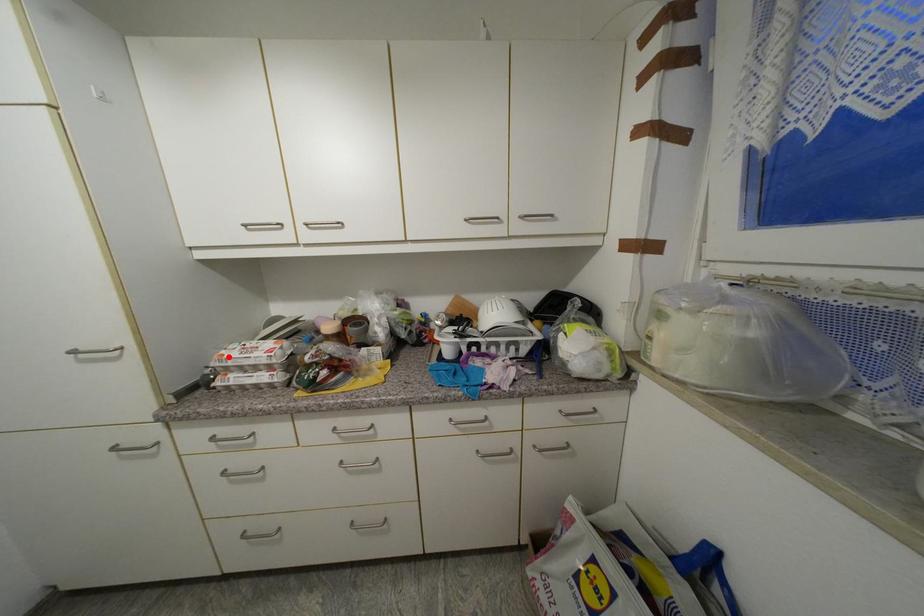
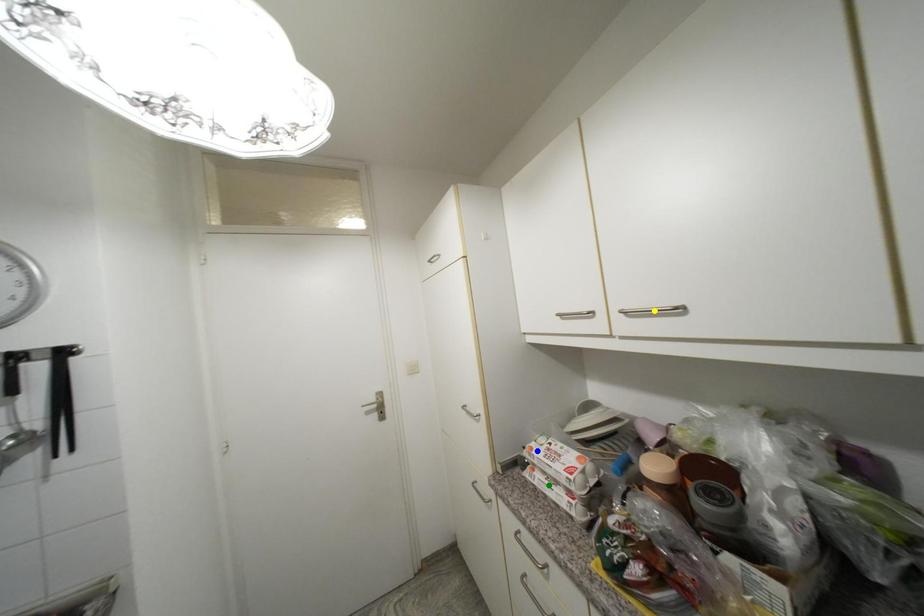
Question: I am providing you with two images of the same scene from different viewpoints. A red point is marked on the first image. You are given multiple points on the second image. Which mark in image 2 goes with the point in image 1?

Choices:
 (A) yellow point
 (B) green point
 (C) blue point

Answer: (C)